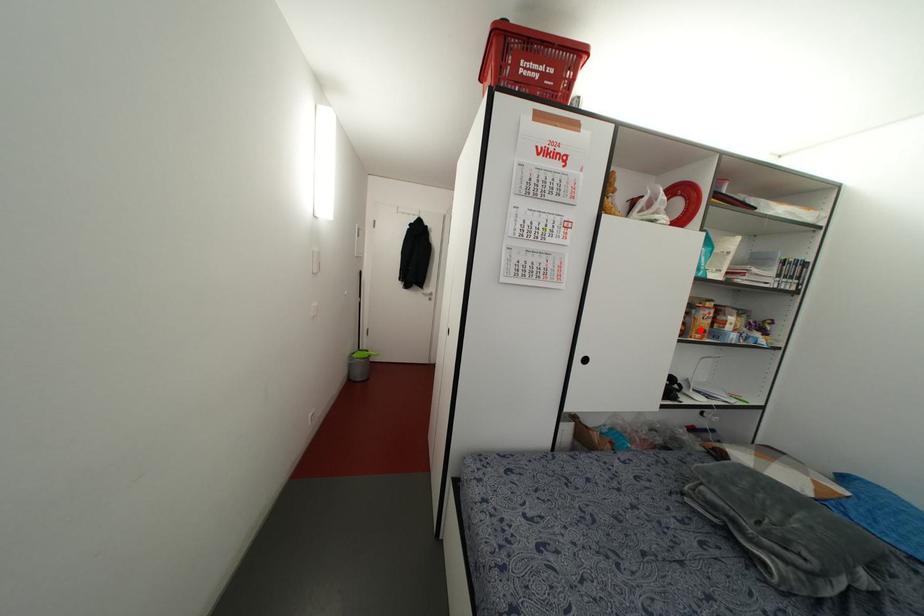
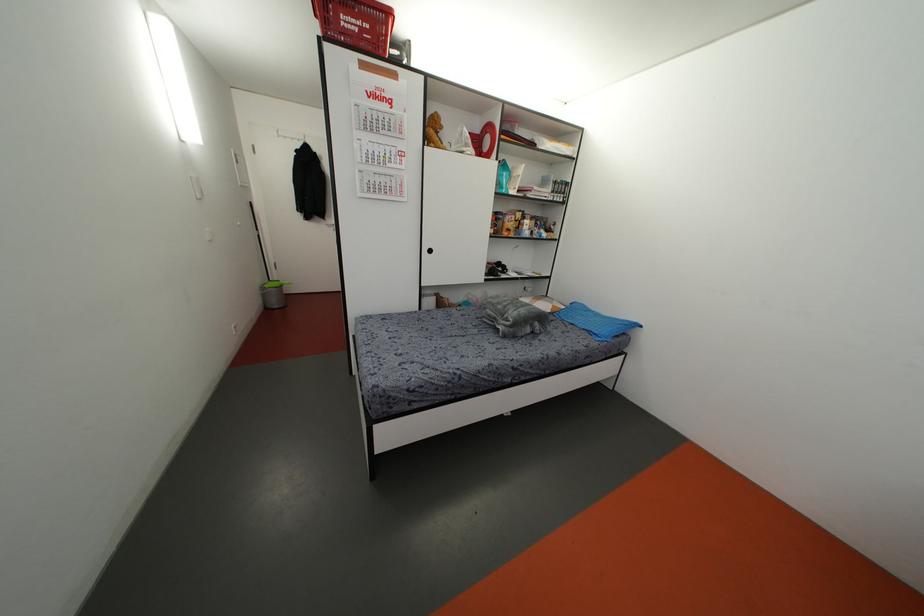
Find the pixel in the second image that matches the highlighted location in the first image.

(507, 229)